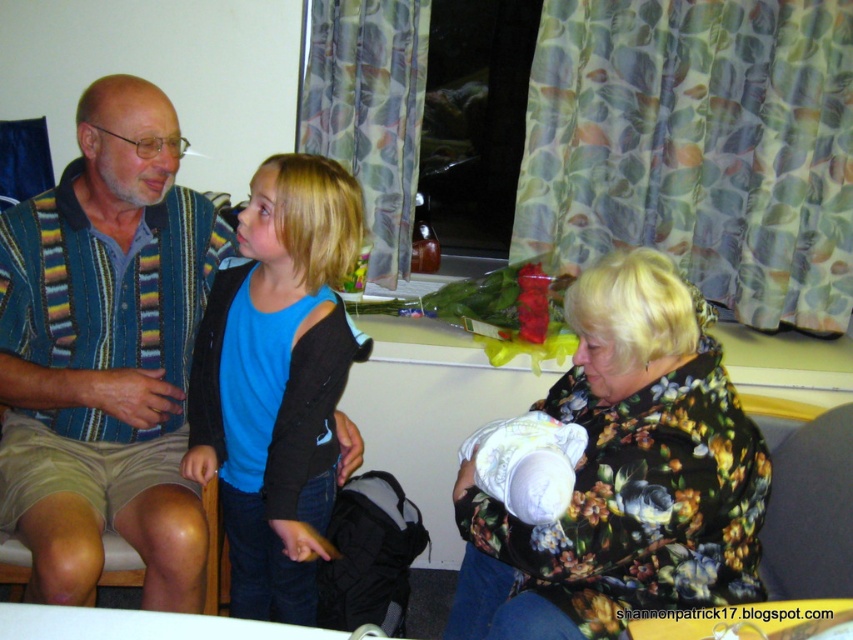
Question: Is striped fabric shirt at left closer to camera compared to floral print sweater at center?

Choices:
 (A) yes
 (B) no

Answer: (B)

Question: Among these points, which one is nearest to the camera?

Choices:
 (A) (340, 381)
 (B) (712, 552)
 (C) (70, 531)

Answer: (B)

Question: Does floral print sweater at center have a lesser width compared to blue cotton shirt at center?

Choices:
 (A) no
 (B) yes

Answer: (A)

Question: Which object is farther from the camera taking this photo?

Choices:
 (A) striped fabric shirt at left
 (B) blue cotton shirt at center

Answer: (A)

Question: Estimate the real-world distances between objects in this image. Which object is closer to the floral print sweater at center?

Choices:
 (A) striped fabric shirt at left
 (B) blue cotton shirt at center

Answer: (B)

Question: Can you confirm if striped fabric shirt at left is positioned to the left of floral print sweater at center?

Choices:
 (A) yes
 (B) no

Answer: (A)